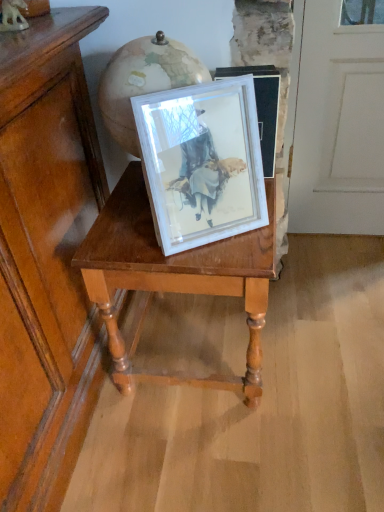
Question: In terms of height, does white matte picture frame at center look taller or shorter compared to wooden table at center?

Choices:
 (A) tall
 (B) short

Answer: (B)

Question: Does point (223, 132) appear closer or farther from the camera than point (271, 238)?

Choices:
 (A) closer
 (B) farther

Answer: (A)

Question: From the image's perspective, is white matte picture frame at center positioned above or below wooden table at center?

Choices:
 (A) below
 (B) above

Answer: (B)

Question: Would you say wooden table at center is inside or outside white matte picture frame at center?

Choices:
 (A) inside
 (B) outside

Answer: (B)

Question: Is wooden table at center wider or thinner than white matte picture frame at center?

Choices:
 (A) thin
 (B) wide

Answer: (B)

Question: From the image's perspective, is wooden table at center located above or below white matte picture frame at center?

Choices:
 (A) above
 (B) below

Answer: (B)

Question: Based on their positions, is wooden table at center located to the left or right of white matte picture frame at center?

Choices:
 (A) right
 (B) left

Answer: (B)